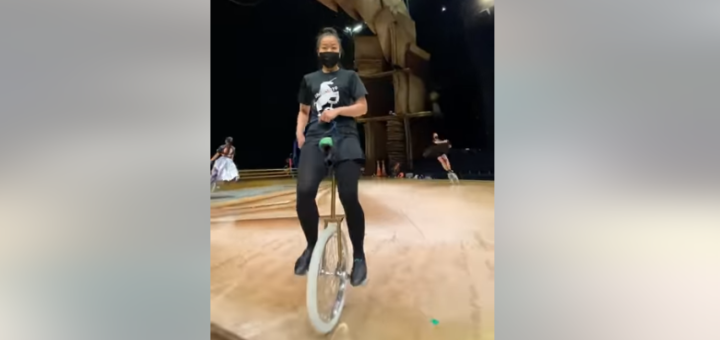
I want to click on stage lights top center, so click(361, 25), click(350, 29).